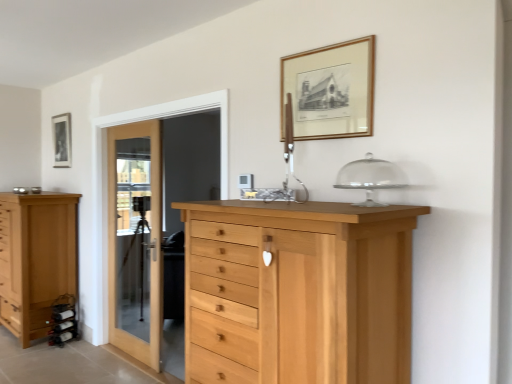
Question: Considering the positions of gold wooden picture frame at upper center, marked as the 2th picture frame in a left-to-right arrangement, and clear glass door at center in the image, is gold wooden picture frame at upper center, marked as the 2th picture frame in a left-to-right arrangement, wider or thinner than clear glass door at center?

Choices:
 (A) wide
 (B) thin

Answer: (B)

Question: From the image's perspective, is gold wooden picture frame at upper center, marked as the 2th picture frame in a left-to-right arrangement, located above or below clear glass door at center?

Choices:
 (A) above
 (B) below

Answer: (A)

Question: Estimate the real-world distances between objects in this image. Which object is farther from the natural wood chest of drawers at center, marked as the 1th chest of drawers in a front-to-back arrangement?

Choices:
 (A) gold wooden picture frame at upper center, which is counted as the 1th picture frame, starting from the right
 (B) light brown wooden chest of drawers at left, placed as the 1th chest of drawers when sorted from back to front
 (C) matte black picture frame at upper left, which is the second picture frame from front to back
 (D) clear glass door at center

Answer: (C)

Question: Based on their relative distances, which object is farther from the matte black picture frame at upper left, the first picture frame in the left-to-right sequence?

Choices:
 (A) light brown wooden chest of drawers at left, acting as the second chest of drawers starting from the front
 (B) clear glass door at center
 (C) gold wooden picture frame at upper center, which is counted as the 1th picture frame, starting from the right
 (D) natural wood chest of drawers at center, the second chest of drawers viewed from the left

Answer: (D)